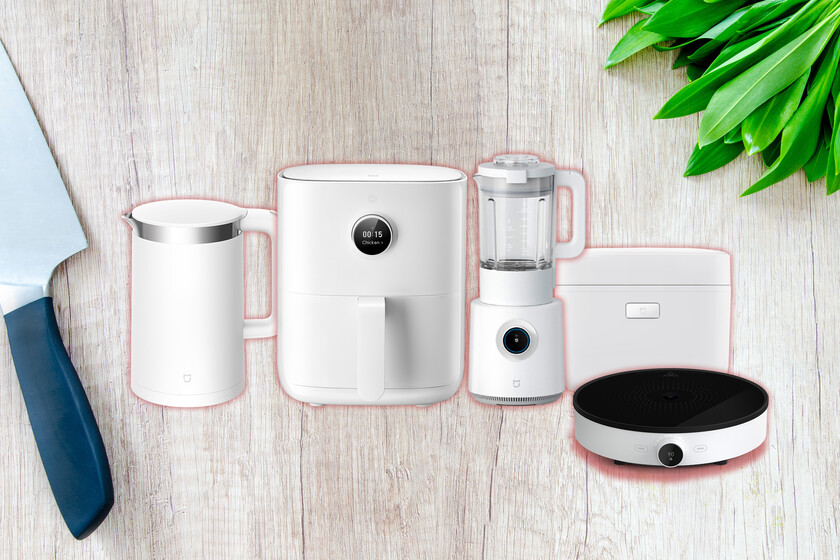
Identify the location of air fryer. The height and width of the screenshot is (560, 840). (327, 260).